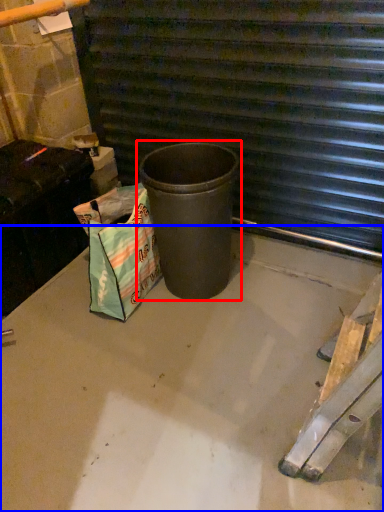
Question: Among these objects, which one is nearest to the camera, waste container (highlighted by a red box) or concrete (highlighted by a blue box)?

Choices:
 (A) waste container
 (B) concrete

Answer: (B)